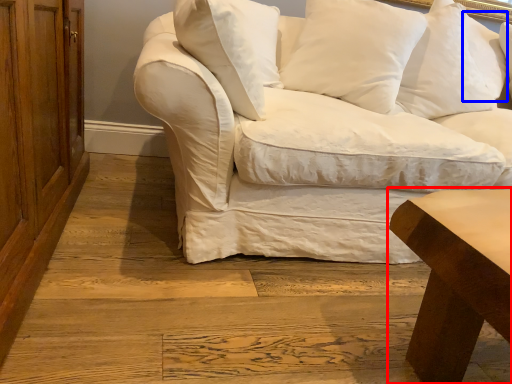
Question: Which point is further to the camera, table (highlighted by a red box) or pillow (highlighted by a blue box)?

Choices:
 (A) table
 (B) pillow

Answer: (B)